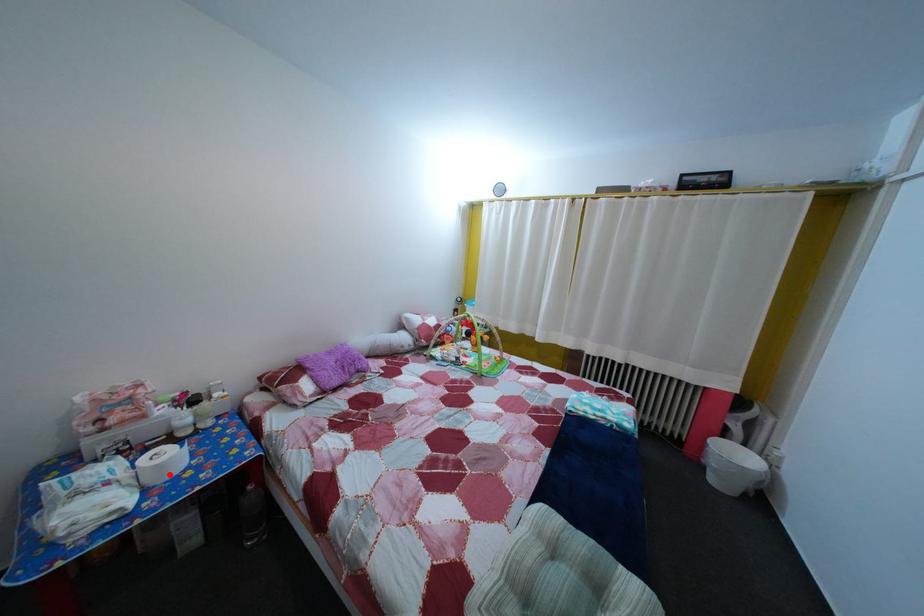
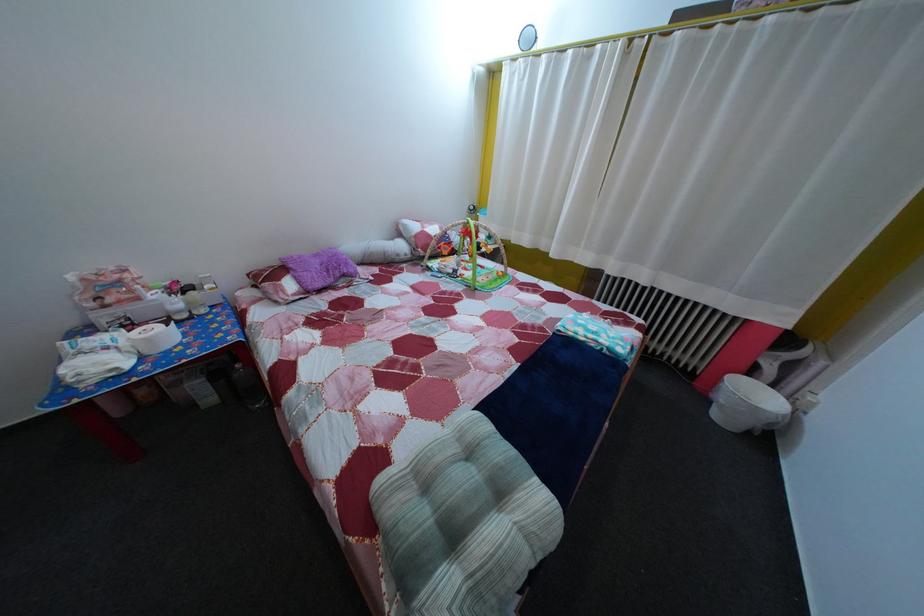
Locate, in the second image, the point that corresponds to the highlighted location in the first image.

(157, 347)